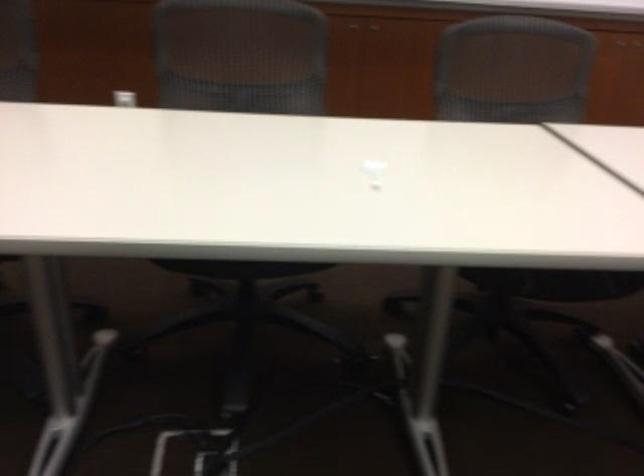
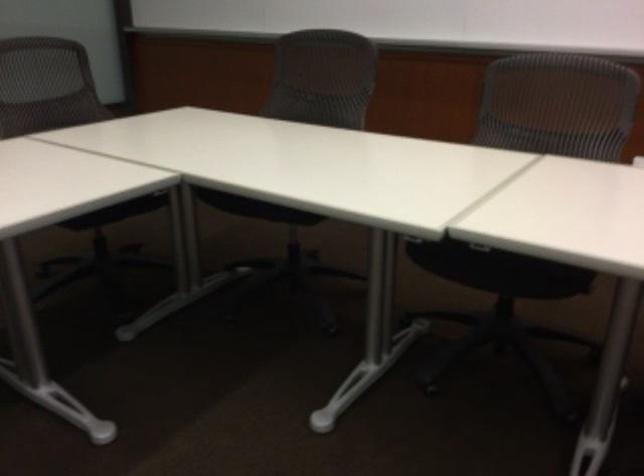
Question: Based on the continuous images, in which direction is the camera rotating? Reply with the corresponding letter.

Choices:
 (A) Left
 (B) Right
 (C) Up
 (D) Down

Answer: (A)